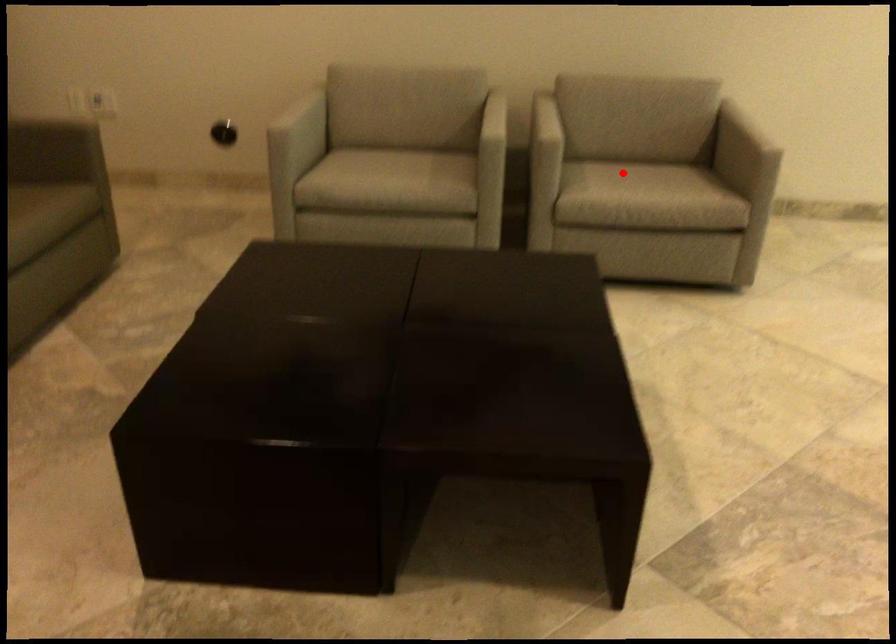
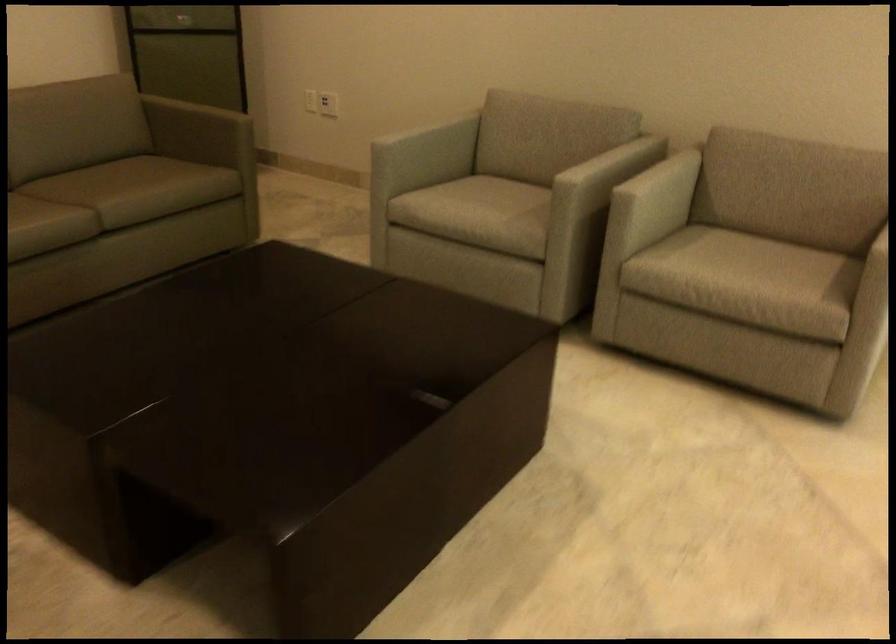
Question: I am providing you with two images of the same scene from different viewpoints. Given a red point in image1, look at the same physical point in image2. Is it:

Choices:
 (A) Closer to the viewpoint
 (B) Farther from the viewpoint

Answer: (A)